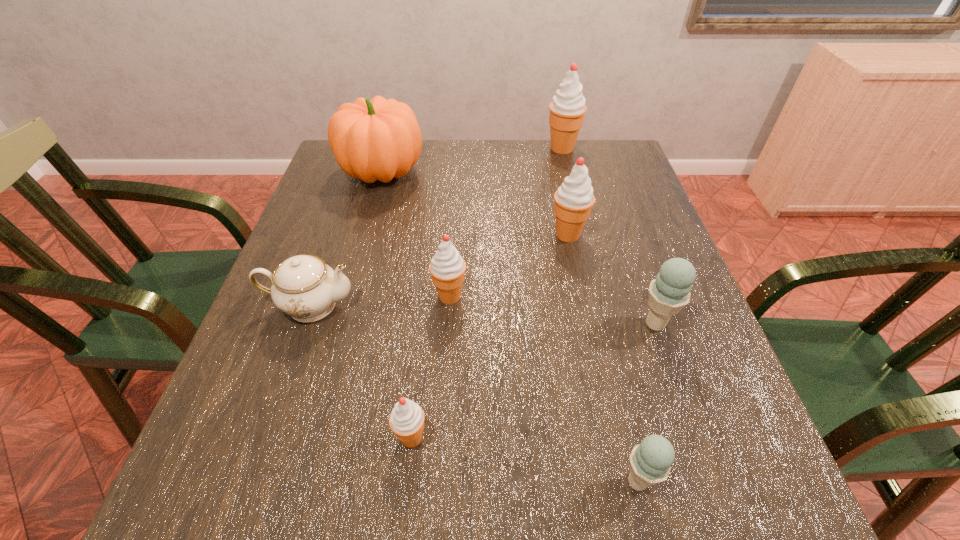
This screenshot has width=960, height=540. I want to click on the nearest red icecream, so click(406, 420).

Find the location of a particular element. Image resolution: width=960 pixels, height=540 pixels. the left blue ice cream is located at coordinates (650, 462).

The image size is (960, 540). Find the location of `the smaller blue ice cream`. the smaller blue ice cream is located at coordinates (650, 462).

Where is `vacant position located 0.310m on the front of the farthest ice cream`? Image resolution: width=960 pixels, height=540 pixels. vacant position located 0.310m on the front of the farthest ice cream is located at coordinates (581, 224).

What are the coordinates of `vacant region located 0.390m on the front of the orange pumpkin` in the screenshot? It's located at (344, 311).

You are a GUI agent. You are given a task and a screenshot of the screen. Output one action in this format:
    pyautogui.click(x=<x>, y=<y>)
    Task: Click on the free location located 0.090m on the left of the second farthest red icecream
    The width and height of the screenshot is (960, 540).
    Given the screenshot: What is the action you would take?
    pyautogui.click(x=512, y=234)

Find the location of `free space located 0.150m on the right of the second smallest red icecream`. free space located 0.150m on the right of the second smallest red icecream is located at coordinates (539, 296).

The image size is (960, 540). In order to click on blank space located 0.190m on the front of the farther blue ice cream in this screenshot , I will do `click(694, 435)`.

Where is `blank area located at the spout of the chinaware`? blank area located at the spout of the chinaware is located at coordinates (430, 305).

Where is `free space located 0.210m on the back of the second nearest ice cream`? free space located 0.210m on the back of the second nearest ice cream is located at coordinates (424, 322).